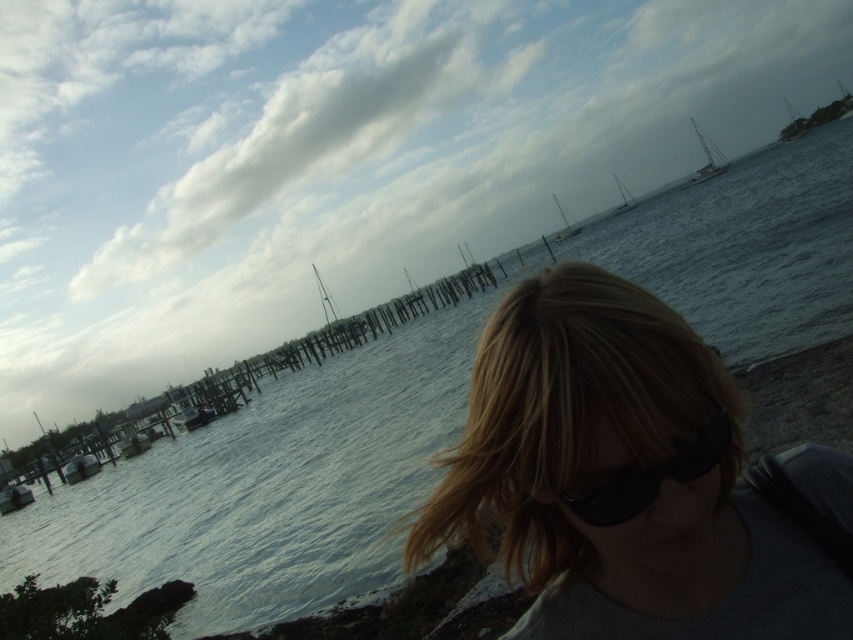
You are a photographer trying to capture a shot of the white plastic sailboat at upper right without the black matte sunglasses at center blocking the view. Is this possible based on their current positions?

The black matte sunglasses at center is positioned under the white plastic sailboat at upper right, so the sunglasses are below the sailboat in the frame. This means the sailboat is above the sunglasses and should not block the view of the sailboat. Therefore, it is possible to capture the sailboat without obstruction.

You are a photographer trying to capture both the black matte sunglasses at center and the white plastic sailboat at upper right in a single frame. Considering their sizes, which object should you position closer to the camera to ensure both fit within the frame?

The black matte sunglasses at center has a lesser width compared to the white plastic sailboat at upper right. To ensure both fit within the frame, position the smaller black matte sunglasses at center closer to the camera and the larger white plastic sailboat at upper right further back.

You are a photographer trying to capture a shot of the blonde hair at lower right and the white matte sailboat at upper center. Based on their sizes in the image, which object appears larger?

The white matte sailboat at upper center appears larger than the blonde hair at lower right because the blonde hair at lower right is not as tall as the white matte sailboat at upper center.